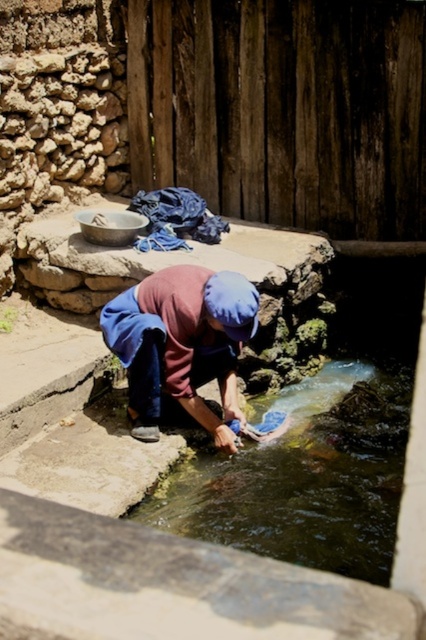
Is point (279, 557) less distant than point (193, 396)?

Yes, it is in front of point (193, 396).

Can you confirm if clear water stream at center is positioned below blue fabric at center?

Yes.

The width and height of the screenshot is (426, 640). Describe the element at coordinates (305, 477) in the screenshot. I see `clear water stream at center` at that location.

Where is `clear water stream at center`? clear water stream at center is located at coordinates (305, 477).

Can you confirm if blue fabric at center is smaller than blue fabric at upper center?

Incorrect, blue fabric at center is not smaller in size than blue fabric at upper center.

Does point (160, 410) come behind point (198, 198)?

No.

Where is `blue fabric at center`? Image resolution: width=426 pixels, height=640 pixels. blue fabric at center is located at coordinates (181, 342).

Does point (339, 560) come farther from viewer compared to point (213, 227)?

No.

Does point (232, 509) come closer to viewer compared to point (144, 211)?

Yes, point (232, 509) is closer to viewer.

At what (x,y) coordinates should I click in order to perform the action: click on clear water stream at center. Please return your answer as a coordinate pair (x, y). The image size is (426, 640). Looking at the image, I should click on (305, 477).